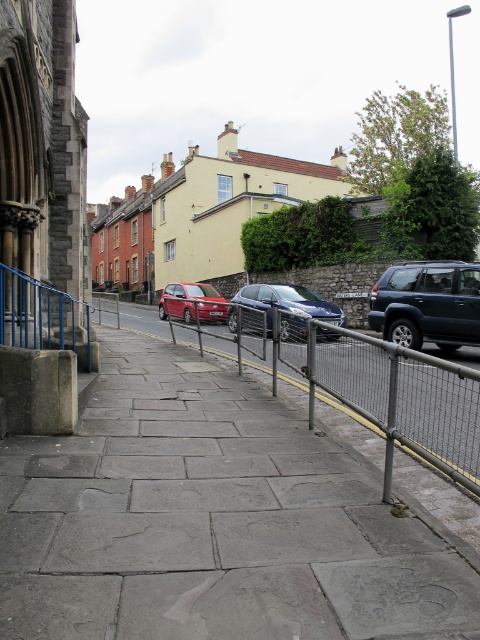
Question: Can you confirm if gray stone pavement at center is thinner than shiny blue sedan at center?

Choices:
 (A) no
 (B) yes

Answer: (B)

Question: Which object is closer to the camera taking this photo?

Choices:
 (A) matte red car at center
 (B) metal mesh fence at center
 (C) gray stone pavement at center
 (D) satin blue suv at right

Answer: (B)

Question: Is gray stone pavement at center in front of metal mesh fence at center?

Choices:
 (A) yes
 (B) no

Answer: (B)

Question: Which object is closer to the camera taking this photo?

Choices:
 (A) matte red car at center
 (B) satin blue suv at right
 (C) shiny blue sedan at center
 (D) metal mesh fence at center

Answer: (D)

Question: Can you confirm if gray stone pavement at center is positioned above matte red car at center?

Choices:
 (A) yes
 (B) no

Answer: (B)

Question: Estimate the real-world distances between objects in this image. Which object is closer to the matte red car at center?

Choices:
 (A) metal mesh fence at center
 (B) satin blue suv at right

Answer: (A)